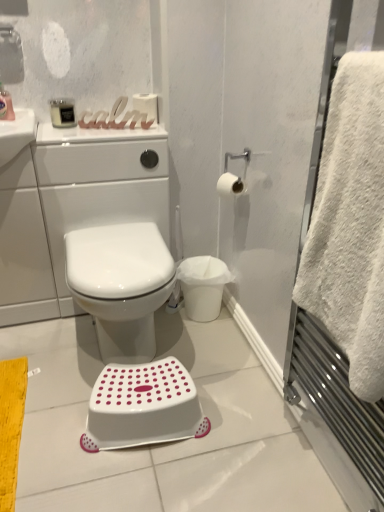
You are a GUI agent. You are given a task and a screenshot of the screen. Output one action in this format:
    pyautogui.click(x=<x>, y=<y>)
    Task: Click on the vacant space situated on the left part of white plastic step stool at center
    
    Given the screenshot: What is the action you would take?
    tap(51, 422)